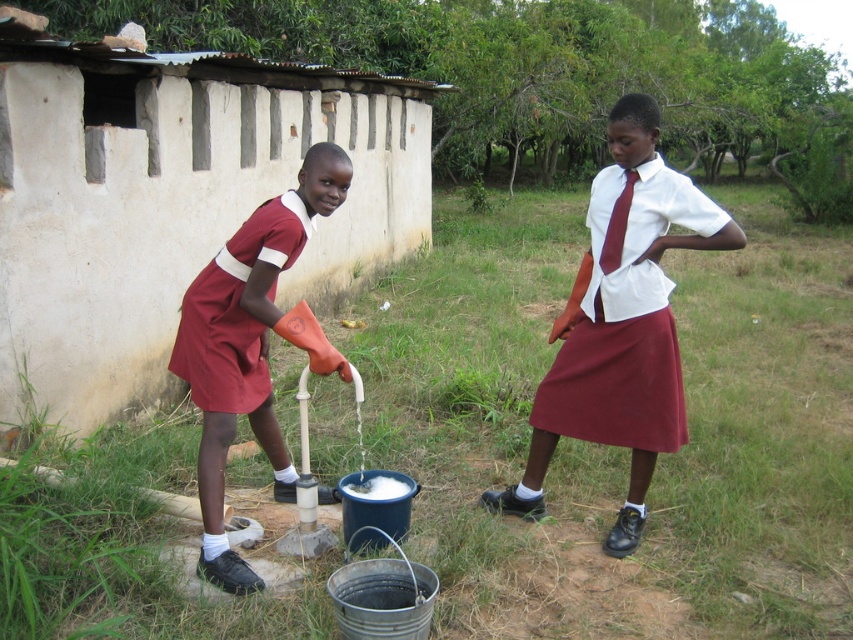
Question: In this image, where is matte white shirt at center located relative to maroon fabric dress at center?

Choices:
 (A) above
 (B) below

Answer: (A)

Question: Which of these objects is positioned farthest from the maroon fabric dress at left?

Choices:
 (A) matte white shirt at center
 (B) maroon fabric dress at center
 (C) maroon fabric dress at right

Answer: (A)

Question: Does maroon fabric dress at center appear on the right side of maroon fabric dress at left?

Choices:
 (A) yes
 (B) no

Answer: (A)

Question: Among these objects, which one is farthest from the camera?

Choices:
 (A) matte white shirt at center
 (B) maroon fabric dress at left
 (C) maroon fabric dress at center
 (D) maroon fabric dress at right

Answer: (A)

Question: Which is farther from the maroon fabric dress at right?

Choices:
 (A) matte white shirt at center
 (B) maroon fabric dress at left

Answer: (B)

Question: Is matte white shirt at center positioned before maroon fabric dress at left?

Choices:
 (A) yes
 (B) no

Answer: (B)